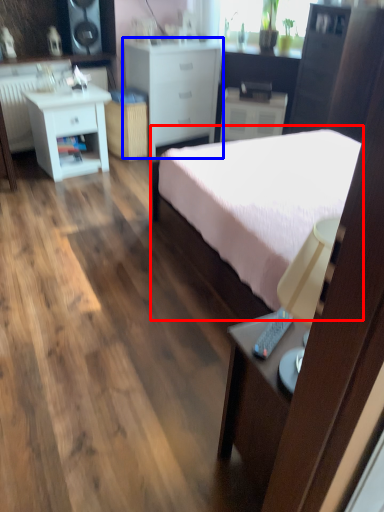
Question: Which of the following is the farthest to the observer, bed (highlighted by a red box) or chest of drawers (highlighted by a blue box)?

Choices:
 (A) bed
 (B) chest of drawers

Answer: (B)